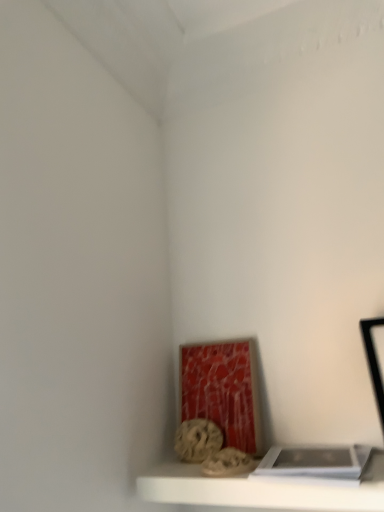
Question: Does white matte book at lower right lie behind white matte shelf at lower center?

Choices:
 (A) no
 (B) yes

Answer: (A)

Question: Is white matte book at lower right not within white matte shelf at lower center?

Choices:
 (A) no
 (B) yes

Answer: (B)

Question: From the image's perspective, is white matte book at lower right over white matte shelf at lower center?

Choices:
 (A) no
 (B) yes

Answer: (B)

Question: Could white matte shelf at lower center be considered to be inside white matte book at lower right?

Choices:
 (A) no
 (B) yes

Answer: (A)

Question: Is white matte book at lower right oriented towards white matte shelf at lower center?

Choices:
 (A) yes
 (B) no

Answer: (B)

Question: Does white matte book at lower right have a smaller size compared to white matte shelf at lower center?

Choices:
 (A) yes
 (B) no

Answer: (A)

Question: Is white matte shelf at lower center to the left of rustic stone sculpture at lower center from the viewer's perspective?

Choices:
 (A) yes
 (B) no

Answer: (B)

Question: Is white matte shelf at lower center oriented towards rustic stone sculpture at lower center?

Choices:
 (A) yes
 (B) no

Answer: (B)

Question: Is white matte shelf at lower center touching rustic stone sculpture at lower center?

Choices:
 (A) no
 (B) yes

Answer: (A)

Question: Is white matte shelf at lower center shorter than rustic stone sculpture at lower center?

Choices:
 (A) yes
 (B) no

Answer: (A)

Question: Is white matte shelf at lower center wider than rustic stone sculpture at lower center?

Choices:
 (A) no
 (B) yes

Answer: (B)

Question: Can you confirm if white matte shelf at lower center is smaller than rustic stone sculpture at lower center?

Choices:
 (A) no
 (B) yes

Answer: (A)

Question: Is rustic stone sculpture at lower center surrounding white matte shelf at lower center?

Choices:
 (A) yes
 (B) no

Answer: (B)